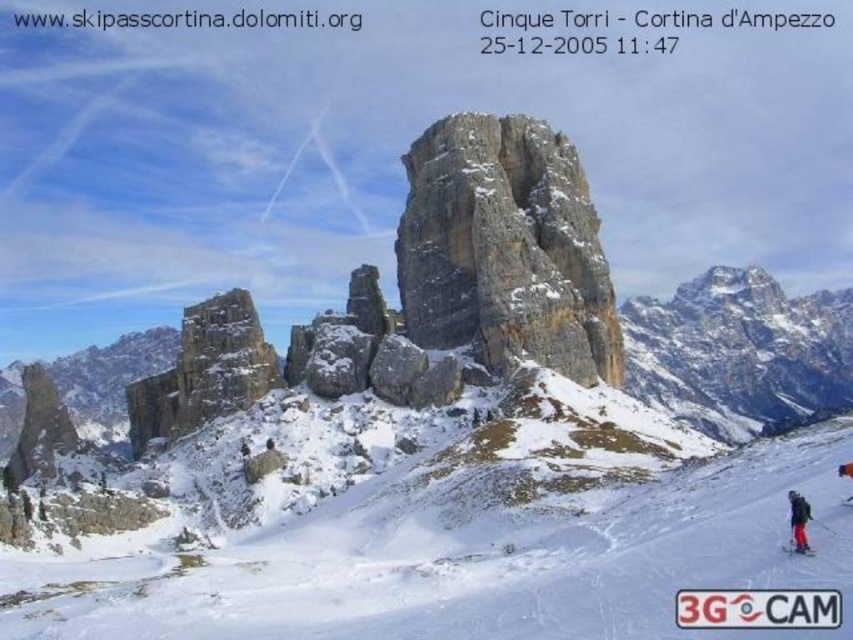
Based on the photo, you are a photographer planning to capture the Cinque Torri mountain range in the background. You have a white snow at center and a red matte ski at lower right in your current frame. Which object should you adjust your focus on if you want the Cinque Torri to be in sharp focus?

The white snow at center is positioned under the red matte ski at lower right, so adjusting focus on the white snow at center would bring the Cinque Torri mountain range in the background into sharp focus.

You are a photographer standing at the bottom of the Cinque Torri mountain range. You see an orange ski suit at lower right and a white plastic ski at lower right. Which object is closer to the left side of the image?

The orange ski suit at lower right is closer to the left side of the image because it is positioned to the left of the white plastic ski at lower right.

You are a photographer planning to capture a photo of the Cinque Torri mountain peaks. You notice two skiers in the foreground, an orange ski suit at lower right and a black ski suit at lower right. Which skier is positioned closer to the base of the Cinque Torri?

The orange ski suit at lower right is located below the black ski suit at lower right, meaning it is closer to the base of the Cinque Torri.